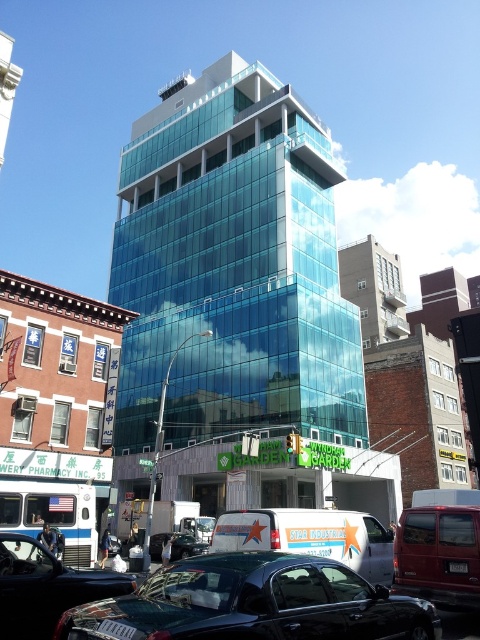
You are a photographer taking a photo of the modern glass building. You notice two points marked in the image. Which point, point [417,637] or point [182,550], is closer to your camera lens?

Point [417,637] is closer to the camera than point [182,550].